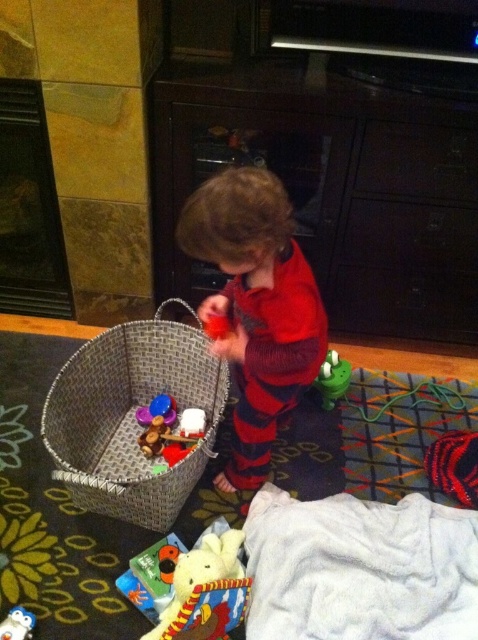
Question: Which object is the farthest from the smooth plastic cup at center?

Choices:
 (A) white plush duck at lower left
 (B) dark wood drawer at center

Answer: (B)

Question: Can you confirm if red corduroy toddler at center is thinner than white plush duck at lower left?

Choices:
 (A) yes
 (B) no

Answer: (B)

Question: In this image, where is red corduroy toddler at center located relative to woven brown basket at lower left?

Choices:
 (A) below
 (B) above

Answer: (B)

Question: Estimate the real-world distances between objects in this image. Which object is closer to the soft plush toy at center?

Choices:
 (A) woven brown basket at lower left
 (B) black matte drawer at center

Answer: (A)

Question: Among these points, which one is farthest from the camera?

Choices:
 (A) (336, 387)
 (B) (444, 209)
 (C) (228, 298)
 (D) (161, 452)

Answer: (A)

Question: Can you confirm if dark wood drawer at center is positioned to the right of wooden toy at center?

Choices:
 (A) yes
 (B) no

Answer: (A)